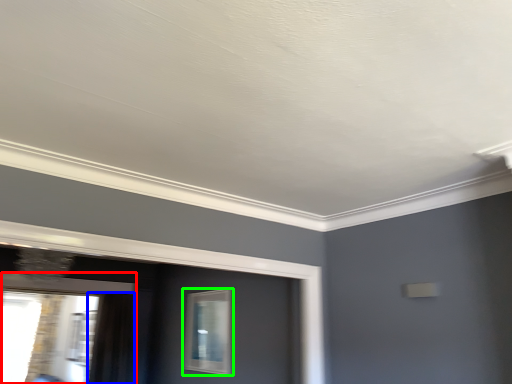
Question: Estimate the real-world distances between objects in this image. Which object is farther from window (highlighted by a red box), curtain (highlighted by a blue box) or window (highlighted by a green box)?

Choices:
 (A) curtain
 (B) window

Answer: (B)